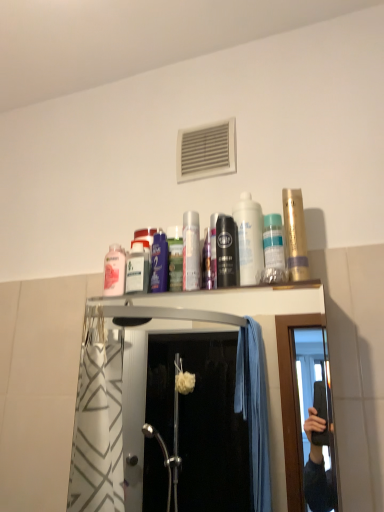
What is the approximate height of translucent plastic mouthwash at upper center, the sixth mouthwash viewed from the left?

translucent plastic mouthwash at upper center, the sixth mouthwash viewed from the left, is 8.54 inches tall.

The width and height of the screenshot is (384, 512). What are the coordinates of `metallic silver mouthwash at center, which appears as the fifth mouthwash when viewed from the right` in the screenshot? It's located at (213, 249).

Find the location of a particular element. The image size is (384, 512). pink glossy mouthwash at upper center, the 7th mouthwash in the right-to-left sequence is located at coordinates (114, 271).

Locate an element on the screen. The image size is (384, 512). black matte mouthwash at center, acting as the 4th mouthwash starting from the right is located at coordinates (227, 252).

Is white plastic air conditioner at upper center turned away from metallic silver mouthwash at center, positioned as the 3th mouthwash in left-to-right order?

No, white plastic air conditioner at upper center is not facing away from metallic silver mouthwash at center, positioned as the 3th mouthwash in left-to-right order.

Considering their positions, is white plastic air conditioner at upper center located in front of or behind metallic silver mouthwash at center, positioned as the 3th mouthwash in left-to-right order?

In the image, white plastic air conditioner at upper center appears behind metallic silver mouthwash at center, positioned as the 3th mouthwash in left-to-right order.

Based on their sizes in the image, would you say white plastic air conditioner at upper center is bigger or smaller than metallic silver mouthwash at center, which appears as the fifth mouthwash when viewed from the right?

white plastic air conditioner at upper center is bigger than metallic silver mouthwash at center, which appears as the fifth mouthwash when viewed from the right.

Is white plastic air conditioner at upper center to the left of metallic silver mouthwash at center, which appears as the fifth mouthwash when viewed from the right, from the viewer's perspective?

Yes.

Is metallic silver mouthwash at center, which appears as the fifth mouthwash when viewed from the right, closer to the viewer compared to black matte mouthwash at center, the fourth mouthwash positioned from the left?

No, metallic silver mouthwash at center, which appears as the fifth mouthwash when viewed from the right, is further to the viewer.

From a real-world perspective, who is located higher, metallic silver mouthwash at center, positioned as the 3th mouthwash in left-to-right order, or black matte mouthwash at center, the fourth mouthwash positioned from the left?

metallic silver mouthwash at center, positioned as the 3th mouthwash in left-to-right order, from a real-world perspective.

Considering the relative sizes of metallic silver mouthwash at center, positioned as the 3th mouthwash in left-to-right order, and black matte mouthwash at center, acting as the 4th mouthwash starting from the right, in the image provided, is metallic silver mouthwash at center, positioned as the 3th mouthwash in left-to-right order, smaller than black matte mouthwash at center, acting as the 4th mouthwash starting from the right,?

Incorrect, metallic silver mouthwash at center, positioned as the 3th mouthwash in left-to-right order, is not smaller in size than black matte mouthwash at center, acting as the 4th mouthwash starting from the right.

Is metallic silver mouthwash at center, which appears as the fifth mouthwash when viewed from the right, oriented away from black matte mouthwash at center, the fourth mouthwash positioned from the left?

No, metallic silver mouthwash at center, which appears as the fifth mouthwash when viewed from the right,'s orientation is not away from black matte mouthwash at center, the fourth mouthwash positioned from the left.

Considering the sizes of objects metallic silver can at center, the 6th mouthwash when ordered from right to left, and pink glossy mouthwash at upper center, the 1th mouthwash viewed from the left, in the image provided, who is bigger, metallic silver can at center, the 6th mouthwash when ordered from right to left, or pink glossy mouthwash at upper center, the 1th mouthwash viewed from the left,?

With larger size is pink glossy mouthwash at upper center, the 1th mouthwash viewed from the left.

Which object is closer to the camera, metallic silver can at center, the second mouthwash viewed from the left, or pink glossy mouthwash at upper center, the 1th mouthwash viewed from the left?

metallic silver can at center, the second mouthwash viewed from the left.

From a real-world perspective, who is located higher, metallic silver can at center, the second mouthwash viewed from the left, or pink glossy mouthwash at upper center, the 1th mouthwash viewed from the left?

In real-world perspective, metallic silver can at center, the second mouthwash viewed from the left, is above.

Can you confirm if metallic silver can at center, the 6th mouthwash when ordered from right to left, is thinner than pink glossy mouthwash at upper center, the 1th mouthwash viewed from the left?

Indeed, metallic silver can at center, the 6th mouthwash when ordered from right to left, has a lesser width compared to pink glossy mouthwash at upper center, the 1th mouthwash viewed from the left.

Is point (107, 293) positioned after point (196, 213)?

No, it is in front of (196, 213).

How many degrees apart are the facing directions of pink glossy mouthwash at upper center, the 7th mouthwash in the right-to-left sequence, and metallic silver can at center, the 6th mouthwash when ordered from right to left?

0.00386 degrees.

From the image's perspective, between pink glossy mouthwash at upper center, the 1th mouthwash viewed from the left, and metallic silver can at center, the second mouthwash viewed from the left, which one is located above?

metallic silver can at center, the second mouthwash viewed from the left, appears higher in the image.

Identify the location of the 1st mouthwash to the left of the translucent plastic mouthwash at upper center, the sixth mouthwash viewed from the left, counting from the anchor's position. This screenshot has width=384, height=512. (249, 238).

Which of these two, translucent plastic mouthwash at upper center, placed as the 2th mouthwash when sorted from right to left, or white glossy mouthwash at center, placed as the third mouthwash when sorted from right to left, is smaller?

translucent plastic mouthwash at upper center, placed as the 2th mouthwash when sorted from right to left, is smaller.

Is point (270, 277) farther from viewer compared to point (245, 283)?

No, it is not.

Is translucent plastic mouthwash at upper center, placed as the 2th mouthwash when sorted from right to left, positioned in front of white glossy mouthwash at center, the 5th mouthwash viewed from the left?

No, it is not.

Is pink glossy mouthwash at upper center, the 1th mouthwash viewed from the left, to the left or to the right of gold metallic mouthwash at upper right, positioned as the 1th mouthwash in right-to-left order, in the image?

Clearly, pink glossy mouthwash at upper center, the 1th mouthwash viewed from the left, is on the left of gold metallic mouthwash at upper right, positioned as the 1th mouthwash in right-to-left order, in the image.

How different are the orientations of pink glossy mouthwash at upper center, the 1th mouthwash viewed from the left, and gold metallic mouthwash at upper right, positioned as the 1th mouthwash in right-to-left order, in degrees?

The angular difference between pink glossy mouthwash at upper center, the 1th mouthwash viewed from the left, and gold metallic mouthwash at upper right, positioned as the 1th mouthwash in right-to-left order, is 0.00305 degrees.

Is point (109, 285) closer or farther from the camera than point (290, 249)?

Point (109, 285) appears to be farther away from the viewer than point (290, 249).

Are pink glossy mouthwash at upper center, the 7th mouthwash in the right-to-left sequence, and gold metallic mouthwash at upper right, which appears as the 7th mouthwash when viewed from the left, making contact?

No, pink glossy mouthwash at upper center, the 7th mouthwash in the right-to-left sequence, is not with gold metallic mouthwash at upper right, which appears as the 7th mouthwash when viewed from the left.

From the image's perspective, which is above, white plastic air conditioner at upper center or metallic silver can at center, the second mouthwash viewed from the left?

white plastic air conditioner at upper center.

Which of these two, white plastic air conditioner at upper center or metallic silver can at center, the 6th mouthwash when ordered from right to left, is smaller?

Smaller between the two is metallic silver can at center, the 6th mouthwash when ordered from right to left.

Looking at this image, from a real-world perspective, is white plastic air conditioner at upper center located beneath metallic silver can at center, the 6th mouthwash when ordered from right to left?

No.

The width and height of the screenshot is (384, 512). I want to click on the 3rd mouthwash in front of the white plastic air conditioner at upper center, so click(x=191, y=252).

Which mouthwash is the 1st one when counting from the right side of the white plastic air conditioner at upper center? Please provide its 2D coordinates.

[(213, 249)]

This screenshot has width=384, height=512. Identify the location of the 3rd mouthwash above the black matte mouthwash at center, the fourth mouthwash positioned from the left (from a real-world perspective). (213, 249).

Based on their spatial positions, is gold metallic mouthwash at upper right, positioned as the 1th mouthwash in right-to-left order, or white plastic air conditioner at upper center further from metallic silver shower at upper center?

gold metallic mouthwash at upper right, positioned as the 1th mouthwash in right-to-left order, is further to metallic silver shower at upper center.

Which object lies nearer to the anchor point white plastic air conditioner at upper center, translucent plastic mouthwash at upper center, placed as the 2th mouthwash when sorted from right to left, or white glossy mouthwash at center, the 5th mouthwash viewed from the left?

Based on the image, white glossy mouthwash at center, the 5th mouthwash viewed from the left, appears to be nearer to white plastic air conditioner at upper center.

Looking at the image, which one is located closer to metallic silver can at center, the second mouthwash viewed from the left, pink glossy mouthwash at upper center, the 7th mouthwash in the right-to-left sequence, or metallic silver shower at upper center?

Based on the image, pink glossy mouthwash at upper center, the 7th mouthwash in the right-to-left sequence, appears to be nearer to metallic silver can at center, the second mouthwash viewed from the left.

Which object lies nearer to the anchor point translucent plastic mouthwash at upper center, placed as the 2th mouthwash when sorted from right to left, white plastic air conditioner at upper center or gold metallic mouthwash at upper right, which appears as the 7th mouthwash when viewed from the left?

gold metallic mouthwash at upper right, which appears as the 7th mouthwash when viewed from the left, lies closer to translucent plastic mouthwash at upper center, placed as the 2th mouthwash when sorted from right to left, than the other object.

Which object lies further to the anchor point translucent plastic mouthwash at upper center, placed as the 2th mouthwash when sorted from right to left, metallic silver mouthwash at center, positioned as the 3th mouthwash in left-to-right order, or pink glossy mouthwash at upper center, the 7th mouthwash in the right-to-left sequence?

pink glossy mouthwash at upper center, the 7th mouthwash in the right-to-left sequence, is positioned further to the anchor translucent plastic mouthwash at upper center, placed as the 2th mouthwash when sorted from right to left.

Considering their positions, is metallic silver mouthwash at center, which appears as the fifth mouthwash when viewed from the right, positioned closer to metallic silver shower at upper center than black matte mouthwash at center, acting as the 4th mouthwash starting from the right?

black matte mouthwash at center, acting as the 4th mouthwash starting from the right.

Considering their positions, is white plastic air conditioner at upper center positioned closer to black matte mouthwash at center, acting as the 4th mouthwash starting from the right, than translucent plastic mouthwash at upper center, placed as the 2th mouthwash when sorted from right to left?

The object closer to black matte mouthwash at center, acting as the 4th mouthwash starting from the right, is translucent plastic mouthwash at upper center, placed as the 2th mouthwash when sorted from right to left.

From the image, which object appears to be nearer to pink glossy mouthwash at upper center, the 1th mouthwash viewed from the left, metallic silver can at center, the second mouthwash viewed from the left, or translucent plastic mouthwash at upper center, placed as the 2th mouthwash when sorted from right to left?

Among the two, metallic silver can at center, the second mouthwash viewed from the left, is located nearer to pink glossy mouthwash at upper center, the 1th mouthwash viewed from the left.

Locate an element on the screen. mouthwash between metallic silver can at center, the second mouthwash viewed from the left, and black matte mouthwash at center, acting as the 4th mouthwash starting from the right, from left to right is located at coordinates (213, 249).

Image resolution: width=384 pixels, height=512 pixels. Identify the location of closet between pink glossy mouthwash at upper center, the 7th mouthwash in the right-to-left sequence, and gold metallic mouthwash at upper right, which appears as the 7th mouthwash when viewed from the left, from left to right. (194, 401).

This screenshot has width=384, height=512. Identify the location of mouthwash located between metallic silver mouthwash at center, which appears as the fifth mouthwash when viewed from the right, and white glossy mouthwash at center, placed as the third mouthwash when sorted from right to left, in the left-right direction. (227, 252).

Where is `closet between pink glossy mouthwash at upper center, the 1th mouthwash viewed from the left, and translucent plastic mouthwash at upper center, placed as the 2th mouthwash when sorted from right to left, in the horizontal direction`? closet between pink glossy mouthwash at upper center, the 1th mouthwash viewed from the left, and translucent plastic mouthwash at upper center, placed as the 2th mouthwash when sorted from right to left, in the horizontal direction is located at coordinates (194, 401).